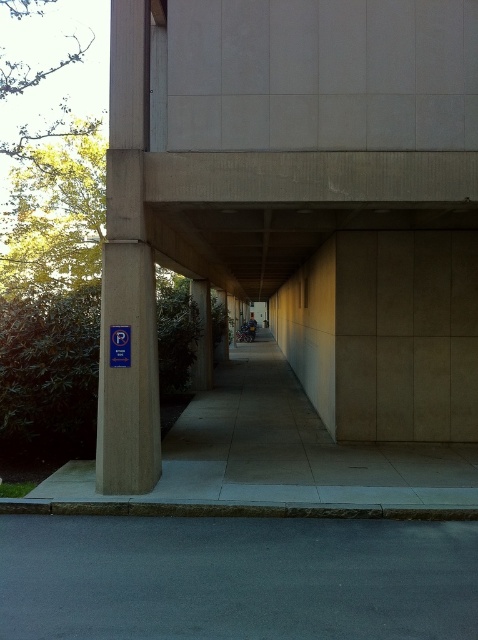
You are a delivery person trying to park your van in the covered walkway. The van requires a parking space that is at least as big as the gray concrete pavement at center. Can the blue plastic parking sign at left provide enough space for your van?

The gray concrete pavement at center has a larger size compared to the blue plastic parking sign at left. Since the van requires a space at least as big as the gray concrete pavement at center, the blue plastic parking sign at left is not large enough to accommodate the van.